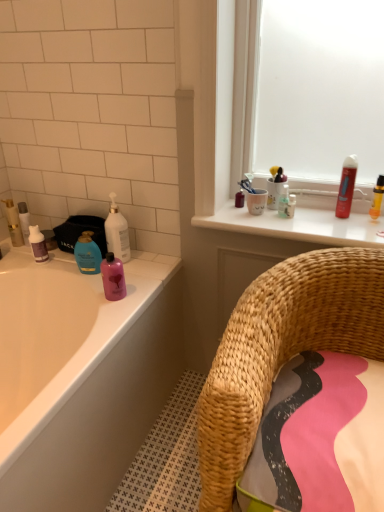
Locate an element on the screen. vacant space situated above pink fabric bath towel at lower right (from a real-world perspective) is located at coordinates (326, 409).